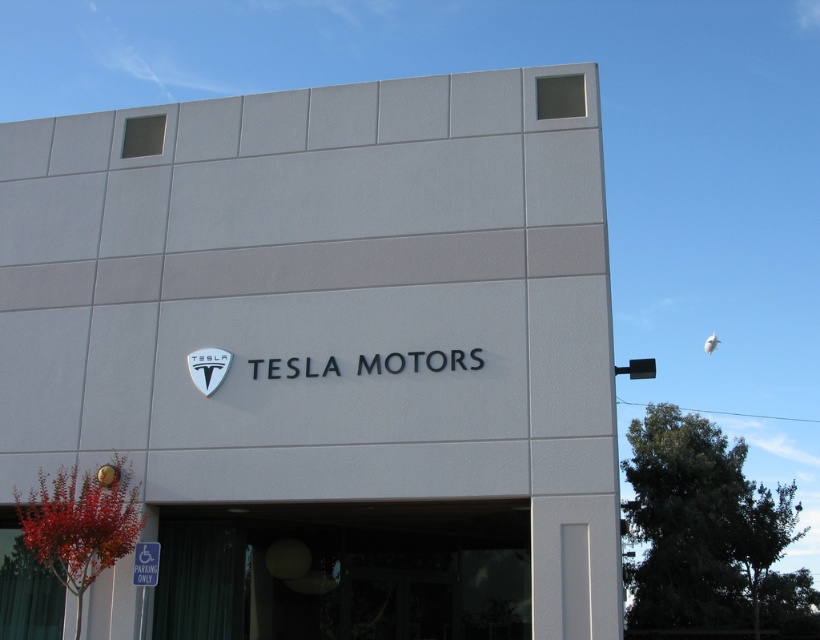
Consider the image. You are standing in front of the Tesla Motors dealership building. You see the white matte sign at center and the transparent glass door at lower center. Which object is shorter in height?

The white matte sign at center has a lesser height compared to the transparent glass door at lower center, so the white matte sign at center is shorter.

You are standing at the entrance of the Tesla Motors dealership and see two points marked on the facade. The first point is at coordinate point (8, 317) and the second point is at coordinate point (431, 586). Which point is closer to you as you face the building?

Point (8, 317) is in front of point (431, 586), so the first point is closer to you as you face the building.